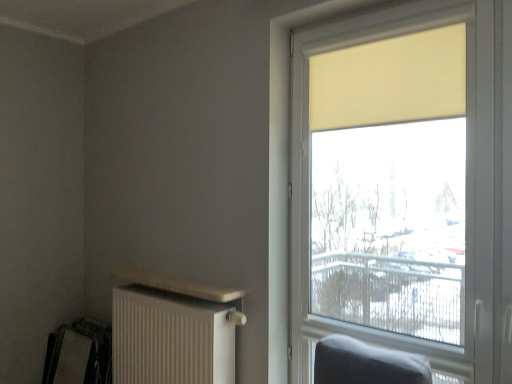
Question: Is metallic silver swivel chair at lower left located within white textured radiator at lower left?

Choices:
 (A) yes
 (B) no

Answer: (B)

Question: Is white textured radiator at lower left located outside metallic silver swivel chair at lower left?

Choices:
 (A) yes
 (B) no

Answer: (A)

Question: Can you confirm if white textured radiator at lower left is thinner than metallic silver swivel chair at lower left?

Choices:
 (A) yes
 (B) no

Answer: (B)

Question: From the image's perspective, is white textured radiator at lower left on metallic silver swivel chair at lower left?

Choices:
 (A) yes
 (B) no

Answer: (A)

Question: Is white textured radiator at lower left bigger than metallic silver swivel chair at lower left?

Choices:
 (A) yes
 (B) no

Answer: (A)

Question: From a real-world perspective, is white textured radiator at lower left physically above metallic silver swivel chair at lower left?

Choices:
 (A) yes
 (B) no

Answer: (A)

Question: From a real-world perspective, is metallic silver swivel chair at lower left positioned under beige fabric curtain at upper right based on gravity?

Choices:
 (A) yes
 (B) no

Answer: (A)

Question: Can you confirm if metallic silver swivel chair at lower left is smaller than beige fabric curtain at upper right?

Choices:
 (A) yes
 (B) no

Answer: (B)

Question: Considering the relative sizes of metallic silver swivel chair at lower left and beige fabric curtain at upper right in the image provided, is metallic silver swivel chair at lower left wider than beige fabric curtain at upper right?

Choices:
 (A) yes
 (B) no

Answer: (A)

Question: Can you confirm if metallic silver swivel chair at lower left is thinner than beige fabric curtain at upper right?

Choices:
 (A) no
 (B) yes

Answer: (A)

Question: Is metallic silver swivel chair at lower left to the right of beige fabric curtain at upper right from the viewer's perspective?

Choices:
 (A) yes
 (B) no

Answer: (B)

Question: From the image's perspective, is metallic silver swivel chair at lower left above beige fabric curtain at upper right?

Choices:
 (A) no
 (B) yes

Answer: (A)

Question: Does matte yellow roller shade at right have a greater width compared to beige fabric curtain at upper right?

Choices:
 (A) yes
 (B) no

Answer: (A)